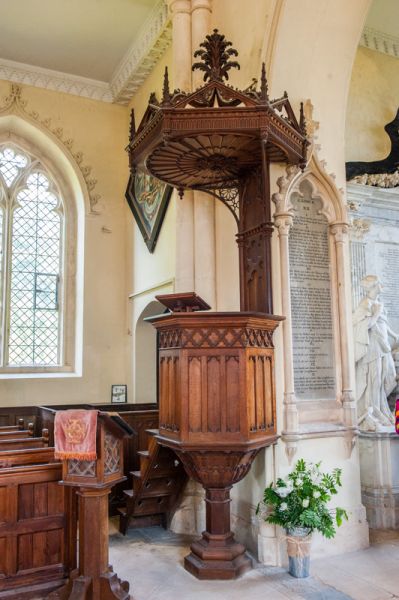
In order to click on stair in this screenshot , I will do `click(124, 510)`, `click(128, 491)`, `click(136, 473)`, `click(143, 455)`, `click(154, 431)`.